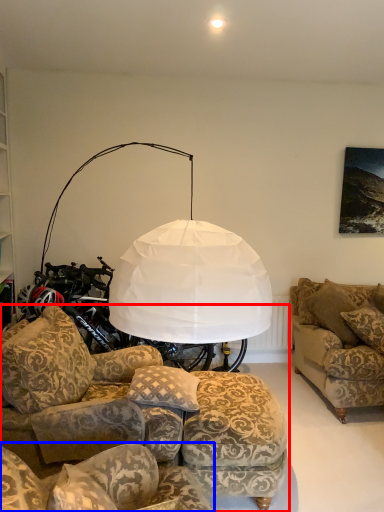
Question: Which object appears farthest to the camera in this image, studio couch (highlighted by a red box) or studio couch (highlighted by a blue box)?

Choices:
 (A) studio couch
 (B) studio couch

Answer: (B)